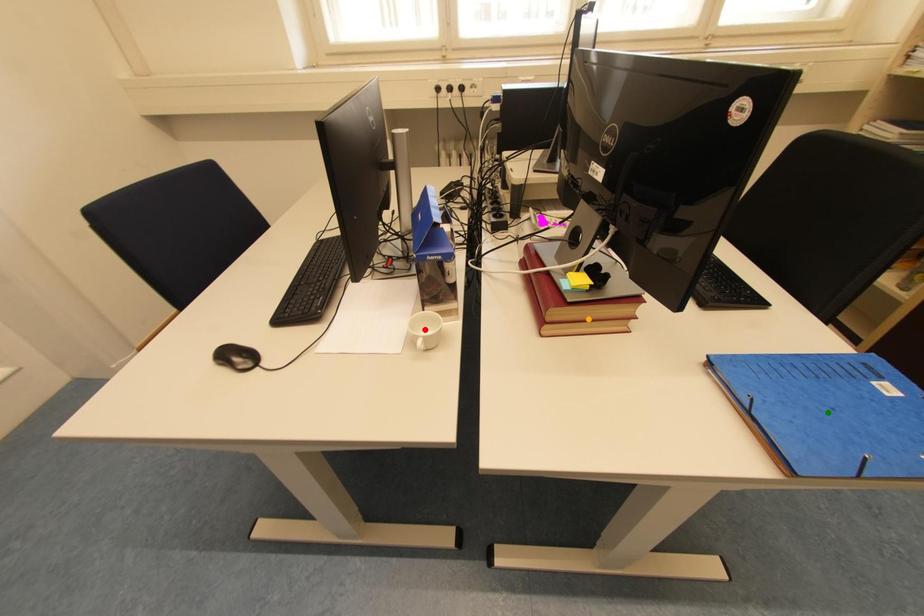
Order these from nearest to farthest:
1. green point
2. orange point
3. red point

green point → orange point → red point